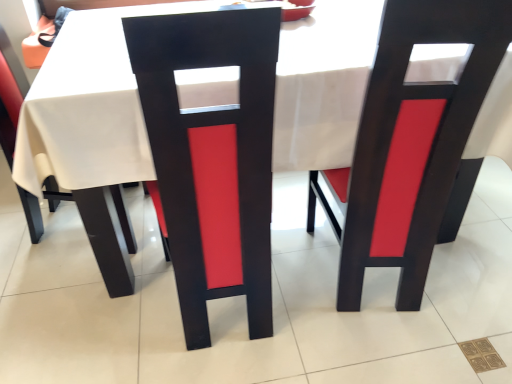
Question: Does matte black chair at left, placed as the 1th chair when sorted from left to right, appear on the right side of matte black chair at center, which is the 1th chair in right-to-left order?

Choices:
 (A) yes
 (B) no

Answer: (B)

Question: From a real-world perspective, does matte black chair at left, the third chair viewed from the right, stand above matte black chair at center, which is the 1th chair in right-to-left order?

Choices:
 (A) no
 (B) yes

Answer: (A)

Question: Are matte black chair at left, placed as the 1th chair when sorted from left to right, and matte black chair at center, which is the 1th chair in right-to-left order, located far from each other?

Choices:
 (A) no
 (B) yes

Answer: (B)

Question: Is matte black chair at left, the third chair viewed from the right, facing towards matte black chair at center, which is the 1th chair in right-to-left order?

Choices:
 (A) yes
 (B) no

Answer: (A)

Question: Is matte black chair at left, placed as the 1th chair when sorted from left to right, taller than matte black chair at center, which is the 3th chair from left to right?

Choices:
 (A) yes
 (B) no

Answer: (B)

Question: Is matte black chair at center, positioned as the 2th chair in left-to-right order, in front of or behind matte black chair at center, which is the 3th chair from left to right, in the image?

Choices:
 (A) behind
 (B) front

Answer: (B)

Question: Considering the positions of point pyautogui.click(x=269, y=314) and point pyautogui.click(x=391, y=82), is point pyautogui.click(x=269, y=314) closer or farther from the camera than point pyautogui.click(x=391, y=82)?

Choices:
 (A) farther
 (B) closer

Answer: (A)

Question: Would you say matte black chair at center, positioned as the 2th chair in left-to-right order, is inside or outside matte black chair at center, which is the 1th chair in right-to-left order?

Choices:
 (A) inside
 (B) outside

Answer: (B)

Question: From the image's perspective, relative to matte black chair at center, which is the 3th chair from left to right, is matte black chair at center, acting as the second chair starting from the right, above or below?

Choices:
 (A) below
 (B) above

Answer: (A)

Question: Is matte black chair at center, positioned as the 2th chair in left-to-right order, to the left or to the right of matte black chair at left, the third chair viewed from the right, in the image?

Choices:
 (A) left
 (B) right

Answer: (B)

Question: From a real-world perspective, is matte black chair at center, acting as the second chair starting from the right, above or below matte black chair at left, placed as the 1th chair when sorted from left to right?

Choices:
 (A) above
 (B) below

Answer: (A)

Question: Considering the positions of matte black chair at center, acting as the second chair starting from the right, and matte black chair at left, the third chair viewed from the right, in the image, is matte black chair at center, acting as the second chair starting from the right, bigger or smaller than matte black chair at left, the third chair viewed from the right,?

Choices:
 (A) big
 (B) small

Answer: (A)

Question: Is matte black chair at center, positioned as the 2th chair in left-to-right order, in front of or behind matte black chair at left, placed as the 1th chair when sorted from left to right, in the image?

Choices:
 (A) front
 (B) behind

Answer: (A)

Question: Does point (0, 94) appear closer or farther from the camera than point (130, 46)?

Choices:
 (A) farther
 (B) closer

Answer: (A)

Question: Is matte black chair at left, the third chair viewed from the right, wider or thinner than matte black chair at center, acting as the second chair starting from the right?

Choices:
 (A) wide
 (B) thin

Answer: (A)